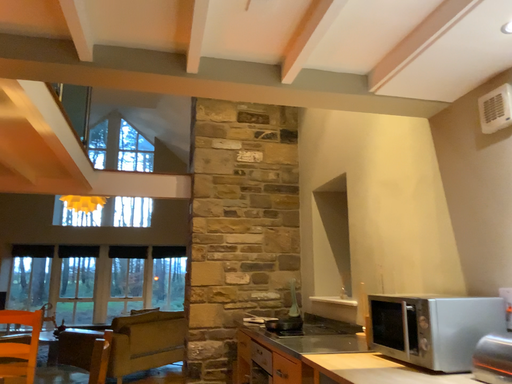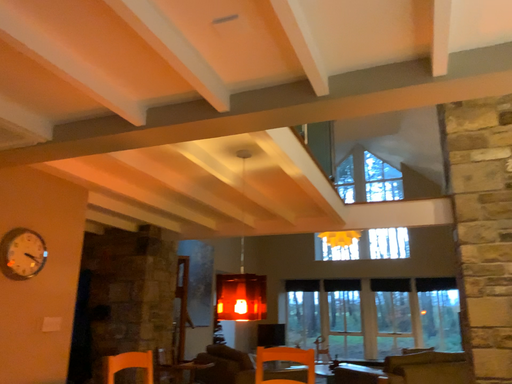
Question: Which way did the camera rotate in the video?

Choices:
 (A) rotated right
 (B) rotated left

Answer: (B)